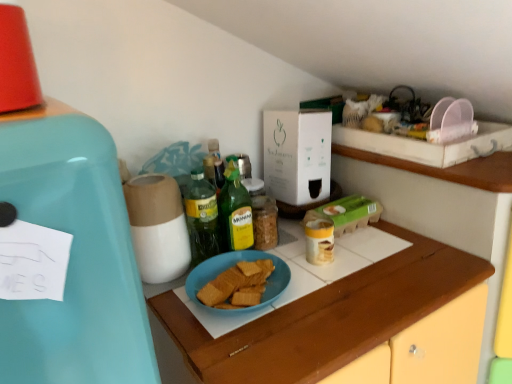
Locate an element on the screen. Image resolution: width=512 pixels, height=384 pixels. vacant space situated above blue matte plate at center (from a real-world perspective) is located at coordinates (338, 286).